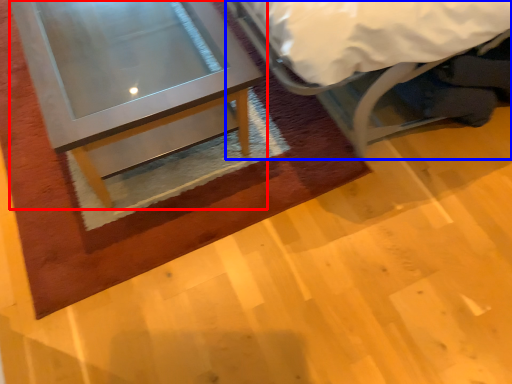
Question: Which object is further to the camera taking this photo, table (highlighted by a red box) or bed (highlighted by a blue box)?

Choices:
 (A) table
 (B) bed

Answer: (A)